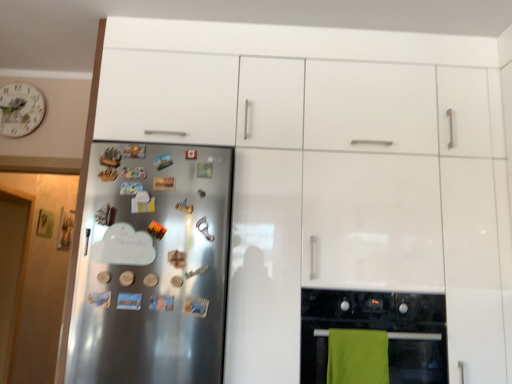
Question: Is satin silver fridge at left aimed at white floral clock at upper left?

Choices:
 (A) no
 (B) yes

Answer: (A)

Question: Is the position of satin silver fridge at left more distant than that of white floral clock at upper left?

Choices:
 (A) yes
 (B) no

Answer: (B)

Question: Is the depth of satin silver fridge at left less than that of white floral clock at upper left?

Choices:
 (A) no
 (B) yes

Answer: (B)

Question: Is satin silver fridge at left to the left of white floral clock at upper left from the viewer's perspective?

Choices:
 (A) no
 (B) yes

Answer: (A)

Question: From the image's perspective, is satin silver fridge at left beneath white floral clock at upper left?

Choices:
 (A) no
 (B) yes

Answer: (B)

Question: Based on their positions, is black glass oven at lower right located to the left or right of white floral clock at upper left?

Choices:
 (A) right
 (B) left

Answer: (A)

Question: Relative to white floral clock at upper left, is black glass oven at lower right in front or behind?

Choices:
 (A) front
 (B) behind

Answer: (A)

Question: Is black glass oven at lower right bigger or smaller than white floral clock at upper left?

Choices:
 (A) big
 (B) small

Answer: (A)

Question: Considering the positions of black glass oven at lower right and white floral clock at upper left in the image, is black glass oven at lower right wider or thinner than white floral clock at upper left?

Choices:
 (A) thin
 (B) wide

Answer: (B)

Question: Would you say white floral clock at upper left is inside or outside black glass oven at lower right?

Choices:
 (A) outside
 (B) inside

Answer: (A)

Question: From the image's perspective, is white floral clock at upper left above or below black glass oven at lower right?

Choices:
 (A) above
 (B) below

Answer: (A)

Question: Looking at the image, does white floral clock at upper left seem bigger or smaller compared to black glass oven at lower right?

Choices:
 (A) small
 (B) big

Answer: (A)

Question: Looking at their shapes, would you say white floral clock at upper left is wider or thinner than black glass oven at lower right?

Choices:
 (A) thin
 (B) wide

Answer: (A)

Question: From a real-world perspective, is satin silver fridge at left above or below green fabric towel at lower center?

Choices:
 (A) above
 (B) below

Answer: (A)

Question: In terms of width, does satin silver fridge at left look wider or thinner when compared to green fabric towel at lower center?

Choices:
 (A) wide
 (B) thin

Answer: (A)